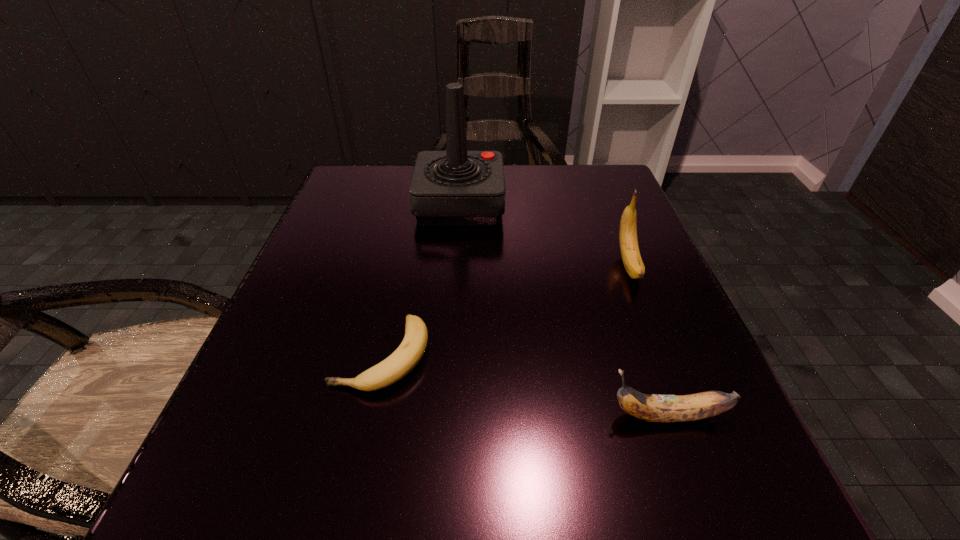
This screenshot has width=960, height=540. What are the coordinates of `free space located at the stem of the nearest banana` in the screenshot? It's located at (294, 416).

Find the location of a particular element. The height and width of the screenshot is (540, 960). vacant region located at the stem of the nearest banana is located at coordinates (325, 416).

You are a GUI agent. You are given a task and a screenshot of the screen. Output one action in this format:
    pyautogui.click(x=<x>, y=<y>)
    Task: Click on the vacant space situated at the stem of the nearest banana
    The image size is (960, 540).
    Given the screenshot: What is the action you would take?
    pyautogui.click(x=317, y=416)

Find the location of a particular element. The image size is (960, 540). vacant area situated 0.080m on the front of the second farthest banana is located at coordinates (360, 455).

Identify the location of object present at the far edge. This screenshot has height=540, width=960. (456, 187).

Identify the location of object situated at the left edge. (403, 360).

Where is `free region at the far edge of the desktop`? This screenshot has height=540, width=960. free region at the far edge of the desktop is located at coordinates (533, 180).

The width and height of the screenshot is (960, 540). I want to click on vacant space at the left edge of the desktop, so click(x=289, y=287).

This screenshot has height=540, width=960. I want to click on vacant region at the right edge of the desktop, so click(x=694, y=355).

Locate an element on the screen. This screenshot has width=960, height=540. blank space at the far left corner is located at coordinates (333, 187).